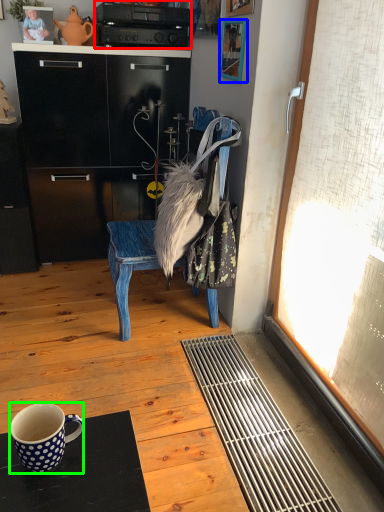
Question: Based on their relative distances, which object is nearer to appliance (highlighted by a red box)? Choose from picture frame (highlighted by a blue box) and coffee cup (highlighted by a green box).

Choices:
 (A) picture frame
 (B) coffee cup

Answer: (A)